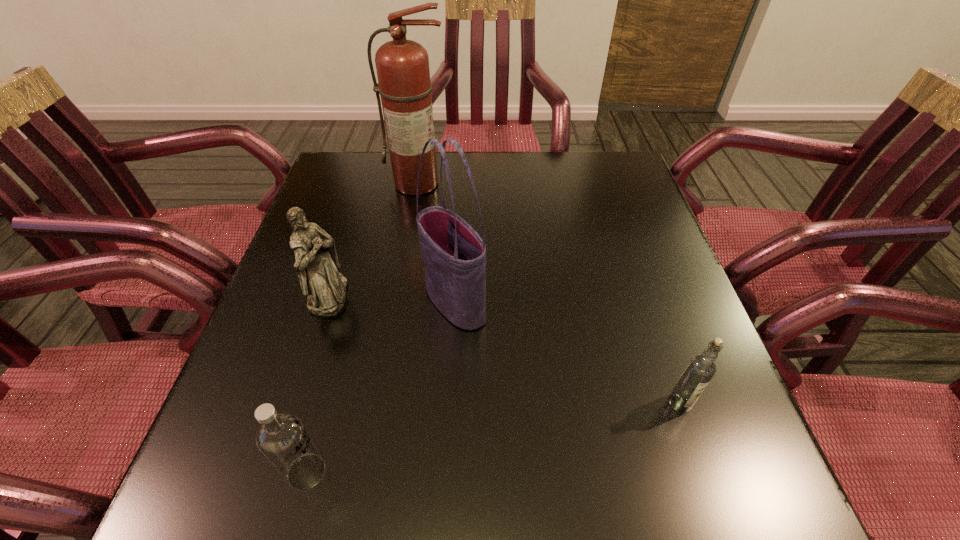
Find the location of a particular element. vacant space at the left edge of the desktop is located at coordinates (354, 238).

This screenshot has width=960, height=540. Identify the location of free location at the right edge of the desktop. (642, 269).

Locate an element on the screen. The image size is (960, 540). vacant space at the far left corner is located at coordinates (365, 187).

The width and height of the screenshot is (960, 540). Find the location of `vacant region at the far right corner of the desktop`. vacant region at the far right corner of the desktop is located at coordinates (574, 151).

Identify the location of unoccupied position between the tallest object and the left vodka. (362, 328).

The width and height of the screenshot is (960, 540). I want to click on unoccupied area between the farther vodka and the nearer vodka, so click(x=493, y=437).

This screenshot has height=540, width=960. What are the coordinates of `free space that is in between the nearer vodka and the rightmost object` in the screenshot? It's located at tap(493, 437).

In order to click on vacant space in between the figurine and the left vodka in this screenshot , I will do `click(318, 383)`.

Where is `vacant region between the left vodka and the figurine`? This screenshot has width=960, height=540. vacant region between the left vodka and the figurine is located at coordinates (318, 383).

The height and width of the screenshot is (540, 960). Find the location of `empty location between the rightmost object and the fire extinguisher`. empty location between the rightmost object and the fire extinguisher is located at coordinates (549, 293).